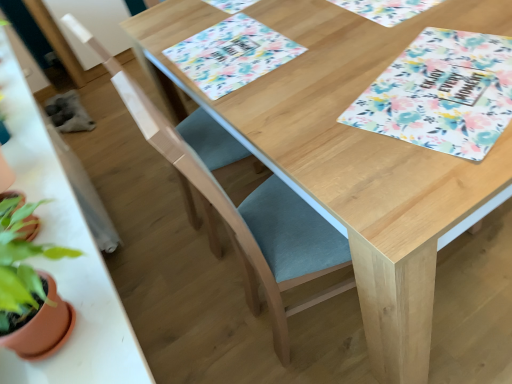
Question: Is light blue fabric folding chair at center, the 2th folding chair viewed from the back, aimed at wooden table at left?

Choices:
 (A) no
 (B) yes

Answer: (A)

Question: Is light blue fabric folding chair at center, the 1th folding chair in the front-to-back sequence, looking in the opposite direction of wooden table at left?

Choices:
 (A) yes
 (B) no

Answer: (B)

Question: Is light blue fabric folding chair at center, the 2th folding chair viewed from the back, with wooden table at left?

Choices:
 (A) no
 (B) yes

Answer: (A)

Question: From the image's perspective, is light blue fabric folding chair at center, the 1th folding chair in the front-to-back sequence, on wooden table at left?

Choices:
 (A) no
 (B) yes

Answer: (A)

Question: Is light blue fabric folding chair at center, the 1th folding chair in the front-to-back sequence, positioned in front of wooden table at left?

Choices:
 (A) yes
 (B) no

Answer: (B)

Question: Is teal fabric folding chair at center, placed as the 2th folding chair when sorted from front to back, in front of or behind wooden table at left in the image?

Choices:
 (A) front
 (B) behind

Answer: (B)

Question: Would you say teal fabric folding chair at center, the first folding chair viewed from the back, is to the left or to the right of wooden table at left in the picture?

Choices:
 (A) right
 (B) left

Answer: (A)

Question: From a real-world perspective, is teal fabric folding chair at center, the first folding chair viewed from the back, positioned above or below wooden table at left?

Choices:
 (A) below
 (B) above

Answer: (A)

Question: From the image's perspective, is teal fabric folding chair at center, the first folding chair viewed from the back, located above or below wooden table at left?

Choices:
 (A) below
 (B) above

Answer: (A)

Question: From the image's perspective, relative to light blue fabric folding chair at center, the 2th folding chair viewed from the back, is floral fabric placemat at upper center, which is the 2th place mat in left-to-right order, above or below?

Choices:
 (A) above
 (B) below

Answer: (A)

Question: Considering the relative positions of floral fabric placemat at upper center, which is the 2th place mat in left-to-right order, and light blue fabric folding chair at center, the 2th folding chair viewed from the back, in the image provided, is floral fabric placemat at upper center, which is the 2th place mat in left-to-right order, to the left or to the right of light blue fabric folding chair at center, the 2th folding chair viewed from the back,?

Choices:
 (A) left
 (B) right

Answer: (B)

Question: In terms of width, does floral fabric placemat at upper center, which is the 2th place mat in left-to-right order, look wider or thinner when compared to light blue fabric folding chair at center, the 2th folding chair viewed from the back?

Choices:
 (A) thin
 (B) wide

Answer: (A)

Question: Is point (394, 21) closer or farther from the camera than point (269, 223)?

Choices:
 (A) farther
 (B) closer

Answer: (A)

Question: From the image's perspective, is floral fabric placemat at upper center, marked as the first place mat in a right-to-left arrangement, positioned above or below teal fabric folding chair at center, placed as the 2th folding chair when sorted from front to back?

Choices:
 (A) below
 (B) above

Answer: (B)

Question: Is floral fabric placemat at upper center, marked as the first place mat in a right-to-left arrangement, taller or shorter than teal fabric folding chair at center, the first folding chair viewed from the back?

Choices:
 (A) tall
 (B) short

Answer: (B)